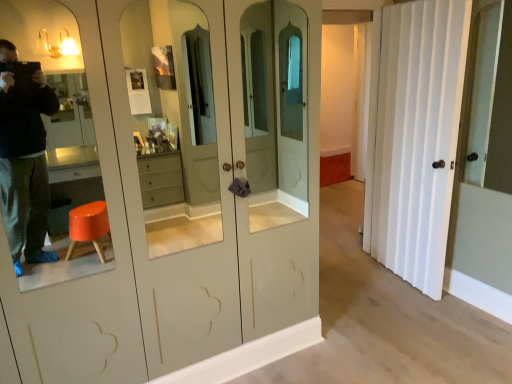
Image resolution: width=512 pixels, height=384 pixels. What do you see at coordinates (417, 137) in the screenshot?
I see `white matte door at right` at bounding box center [417, 137].

You are a GUI agent. You are given a task and a screenshot of the screen. Output one action in this format:
    pyautogui.click(x=<x>, y=<y>)
    Task: Click on the white matte door at right
    
    Given the screenshot: What is the action you would take?
    pyautogui.click(x=417, y=137)

What is the approximate width of white matte door at right?

The width of white matte door at right is 7.27 inches.

The height and width of the screenshot is (384, 512). What are the coordinates of `white matte door at right` in the screenshot? It's located at [x=417, y=137].